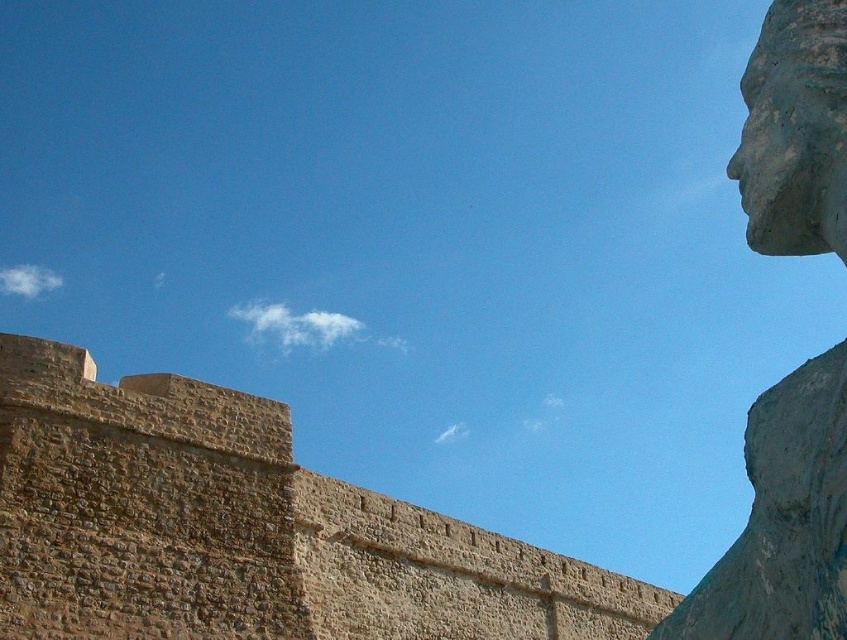
Can you confirm if green stone face at upper right is positioned below rustic stone head at upper right?

Yes.

Consider the image. How distant is green stone face at upper right from rustic stone head at upper right?

They are 13.98 meters apart.

Does point (762, 470) come behind point (833, 140)?

No, it is not.

The height and width of the screenshot is (640, 847). Find the location of `green stone face at upper right`. green stone face at upper right is located at coordinates (783, 520).

Can you confirm if brown stone wall at center is positioned to the left of rustic stone head at upper right?

Indeed, brown stone wall at center is positioned on the left side of rustic stone head at upper right.

Is point (57, 630) positioned in front of point (814, 228)?

No, it is not.

At what (x,y) coordinates should I click in order to perform the action: click on brown stone wall at center. Please return your answer as a coordinate pair (x, y). Looking at the image, I should click on (244, 529).

Between point (180, 435) and point (771, 209), which one is positioned behind?

The point (180, 435) is more distant.

Looking at this image, is brown stone wall at center closer to the viewer compared to green stone face at upper right?

No, brown stone wall at center is behind green stone face at upper right.

This screenshot has height=640, width=847. Find the location of `brown stone wall at center`. brown stone wall at center is located at coordinates (244, 529).

This screenshot has height=640, width=847. In order to click on brown stone wall at center in this screenshot , I will do `click(244, 529)`.